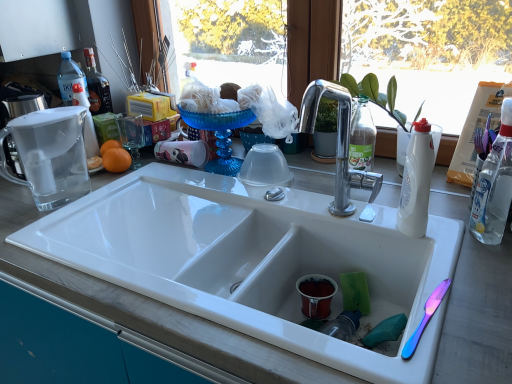
Question: Is clear glass pitcher at upper left bigger than white plastic bottle at right, which is counted as the second bottle, starting from the left?

Choices:
 (A) no
 (B) yes

Answer: (B)

Question: Is clear glass pitcher at upper left not inside white plastic bottle at right, the second bottle when ordered from right to left?

Choices:
 (A) yes
 (B) no

Answer: (A)

Question: From a real-world perspective, does clear glass pitcher at upper left stand above white plastic bottle at right, which appears as the 2th bottle when viewed from the back?

Choices:
 (A) yes
 (B) no

Answer: (A)

Question: From a real-world perspective, is clear glass pitcher at upper left below white plastic bottle at right, acting as the 2th bottle starting from the front?

Choices:
 (A) no
 (B) yes

Answer: (A)

Question: Is clear glass pitcher at upper left taller than white plastic bottle at right, which appears as the 2th bottle when viewed from the back?

Choices:
 (A) yes
 (B) no

Answer: (A)

Question: From a real-world perspective, is white plastic bottle at right, the first bottle in the front-to-back sequence, physically located above or below orangesmoothfruit at left?

Choices:
 (A) above
 (B) below

Answer: (A)

Question: Is point (510, 119) positioned closer to the camera than point (111, 157)?

Choices:
 (A) closer
 (B) farther

Answer: (A)

Question: Looking at the image, does white plastic bottle at right, the 3th bottle in the back-to-front sequence, seem bigger or smaller compared to orangesmoothfruit at left?

Choices:
 (A) big
 (B) small

Answer: (A)

Question: Based on their positions, is white plastic bottle at right, the first bottle in the front-to-back sequence, located to the left or right of orangesmoothfruit at left?

Choices:
 (A) left
 (B) right

Answer: (B)

Question: Based on their sizes in the image, would you say white plastic bottle at right, which appears as the 2th bottle when viewed from the back, is bigger or smaller than white ceramic sink at center?

Choices:
 (A) big
 (B) small

Answer: (B)

Question: In the image, is white plastic bottle at right, the second bottle when ordered from right to left, positioned in front of or behind white ceramic sink at center?

Choices:
 (A) front
 (B) behind

Answer: (B)

Question: Is point (414, 183) closer or farther from the camera than point (440, 311)?

Choices:
 (A) farther
 (B) closer

Answer: (A)

Question: In the image, is white plastic bottle at right, which is counted as the second bottle, starting from the left, on the left side or the right side of white ceramic sink at center?

Choices:
 (A) left
 (B) right

Answer: (B)

Question: Does point (178, 152) appear closer or farther from the camera than point (406, 213)?

Choices:
 (A) farther
 (B) closer

Answer: (A)

Question: Is matte white coffee cup at center, positioned as the 1th coffee cup in left-to-right order, wider or thinner than white plastic bottle at right, which appears as the 2th bottle when viewed from the back?

Choices:
 (A) thin
 (B) wide

Answer: (A)